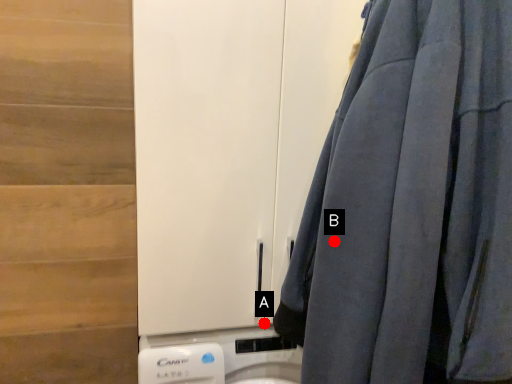
Question: Two points are circled on the image, labeled by A and B beside each circle. Which point is closer to the camera?

Choices:
 (A) A is closer
 (B) B is closer

Answer: (B)